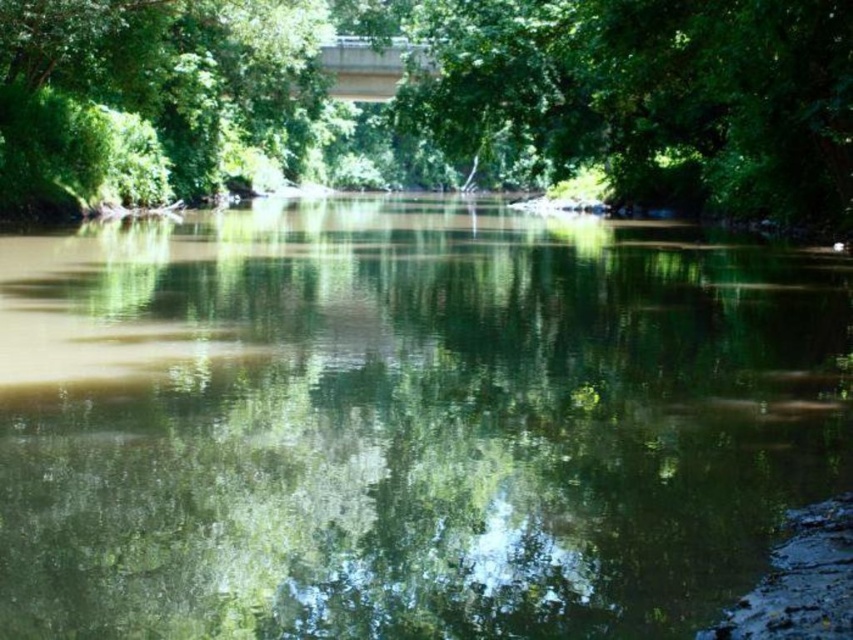
Question: Observing the image, what is the correct spatial positioning of green reflective water at center in reference to concrete bridge at upper center?

Choices:
 (A) left
 (B) right

Answer: (B)

Question: Which point is closer to the camera taking this photo?

Choices:
 (A) (238, 108)
 (B) (579, 144)

Answer: (B)

Question: Which object appears farthest from the camera in this image?

Choices:
 (A) concrete bridge at upper center
 (B) green reflective water at center
 (C) green leafy tree at upper center
 (D) green leafy tree at center

Answer: (A)

Question: Can you confirm if green reflective water at center is bigger than green leafy tree at upper center?

Choices:
 (A) no
 (B) yes

Answer: (A)

Question: Observing the image, what is the correct spatial positioning of green reflective water at center in reference to green leafy tree at upper center?

Choices:
 (A) above
 (B) below

Answer: (B)

Question: Which point is closer to the camera taking this photo?

Choices:
 (A) (440, 420)
 (B) (128, 3)

Answer: (A)